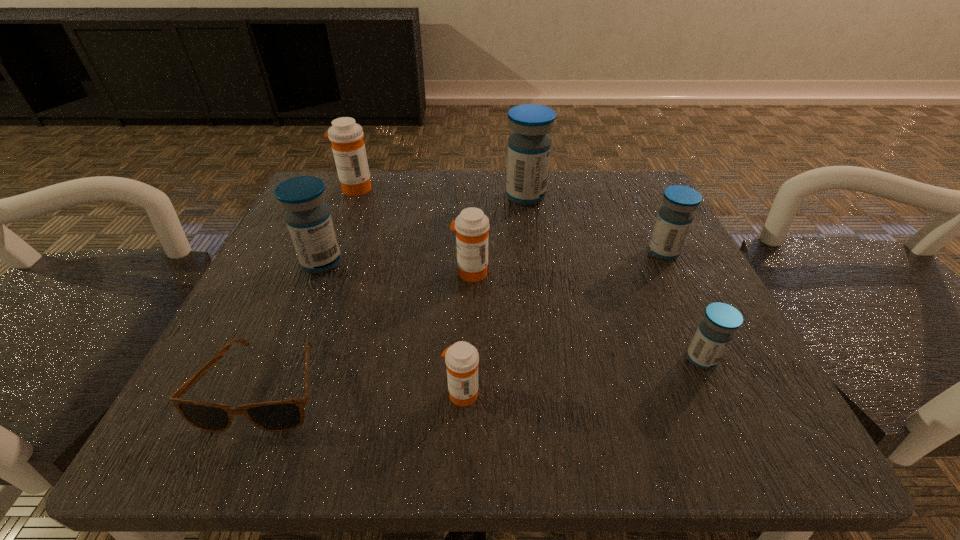
Where is `object that is the fifth closest one to the second smallest blue medicine`? The width and height of the screenshot is (960, 540). object that is the fifth closest one to the second smallest blue medicine is located at coordinates (283, 415).

Identify which object is located as the fourth nearest to the sixth farthest medicine. Please provide its 2D coordinates. Your answer should be formatted as a tuple, i.e. [(x, y)], where the tuple contains the x and y coordinates of a point satisfying the conditions above.

[(529, 146)]

This screenshot has width=960, height=540. What are the coordinates of `medicine that is the third nearest to the second smallest blue medicine` in the screenshot? It's located at (472, 225).

The image size is (960, 540). I want to click on the sixth closest medicine to the smallest blue medicine, so click(x=348, y=147).

Select which blue medicine appears as the second closest to the second biggest orange medicine. Please provide its 2D coordinates. Your answer should be formatted as a tuple, i.e. [(x, y)], where the tuple contains the x and y coordinates of a point satisfying the conditions above.

[(308, 218)]

You are a GUI agent. You are given a task and a screenshot of the screen. Output one action in this format:
    pyautogui.click(x=<x>, y=<y>)
    Task: Click on the third closest blue medicine to the shortest object
    This screenshot has width=960, height=540.
    Given the screenshot: What is the action you would take?
    pyautogui.click(x=716, y=330)

Point out which orange medicine is positioned as the third nearest to the third object from right to left. Please provide its 2D coordinates. Your answer should be formatted as a tuple, i.e. [(x, y)], where the tuple contains the x and y coordinates of a point satisfying the conditions above.

[(461, 359)]

The height and width of the screenshot is (540, 960). Find the location of `orange medicine that can be found as the second closest to the third biggest blue medicine`. orange medicine that can be found as the second closest to the third biggest blue medicine is located at coordinates (461, 359).

Locate an element on the screen. This screenshot has height=540, width=960. free location that satisfies the following two spatial constraints: 1. on the back side of the third smallest blue medicine; 2. on the right side of the farthest orange medicine is located at coordinates (352, 188).

At what (x,y) coordinates should I click in order to perform the action: click on vacant space that satisfies the following two spatial constraints: 1. on the front side of the second nearest orange medicine; 2. on the right side of the smallest blue medicine. Please return your answer as a coordinate pair (x, y). Image resolution: width=960 pixels, height=540 pixels. Looking at the image, I should click on (468, 359).